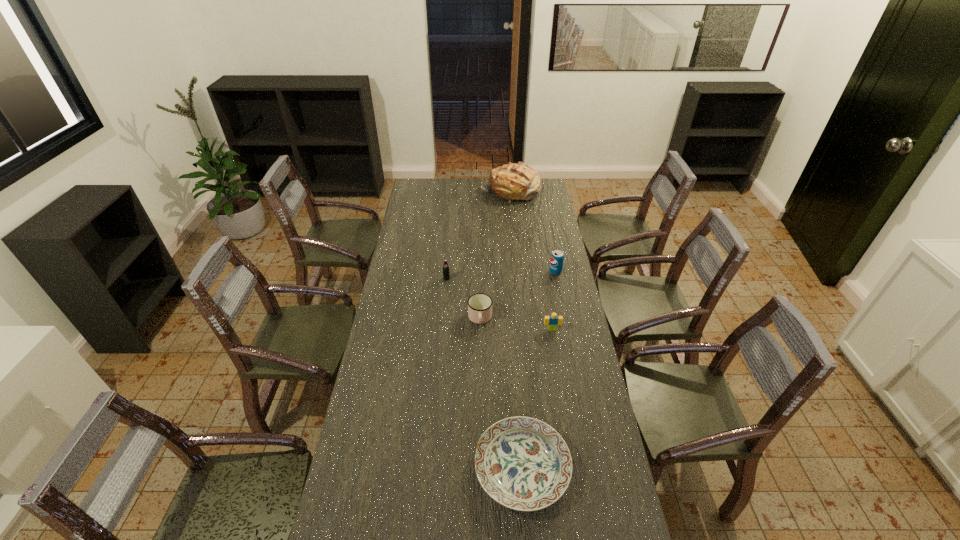
This screenshot has height=540, width=960. I want to click on the farthest object, so click(519, 181).

Image resolution: width=960 pixels, height=540 pixels. I want to click on the tallest object, so click(519, 181).

Where is `the right pop`? the right pop is located at coordinates tap(557, 257).

Find the location of a particular element. the fifth nearest object is located at coordinates pos(557,257).

Locate an element on the screen. the left pop is located at coordinates (446, 274).

I want to click on the fourth nearest object, so click(x=446, y=274).

Where is `Lego`? The width and height of the screenshot is (960, 540). Lego is located at coordinates (552, 321).

Where is `mug`? The width and height of the screenshot is (960, 540). mug is located at coordinates (479, 305).

Where is `plate`? plate is located at coordinates (522, 463).

Where is `the shortest object`? the shortest object is located at coordinates (522, 463).